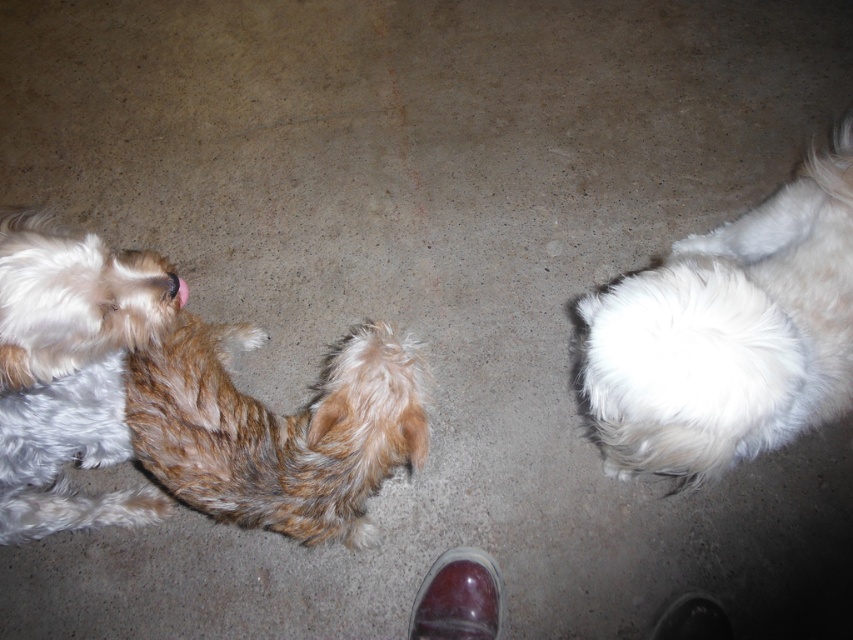
Question: Is white fluffy dog at right above brown fuzzy tail at center?

Choices:
 (A) no
 (B) yes

Answer: (B)

Question: Which of the following is the farthest from the observer?

Choices:
 (A) brown fuzzy tail at center
 (B) white fluffy dog at right

Answer: (A)

Question: Among these objects, which one is nearest to the camera?

Choices:
 (A) brown fuzzy tail at center
 (B) brown shaggy dog at left
 (C) white fluffy dog at right

Answer: (C)

Question: Is white fluffy dog at right smaller than brown shaggy dog at left?

Choices:
 (A) no
 (B) yes

Answer: (A)

Question: Estimate the real-world distances between objects in this image. Which object is farther from the white fluffy dog at right?

Choices:
 (A) brown fuzzy tail at center
 (B) brown shaggy dog at left

Answer: (B)

Question: Can you confirm if white fluffy dog at right is positioned to the right of brown shaggy dog at left?

Choices:
 (A) yes
 (B) no

Answer: (A)